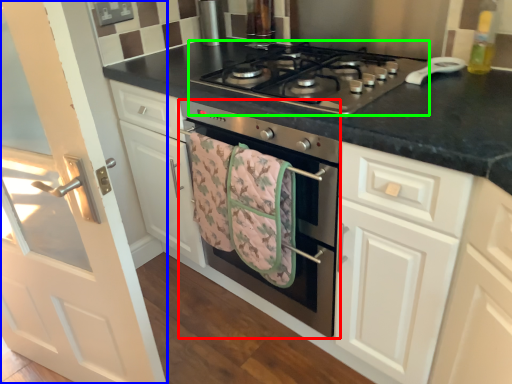
Question: Based on their relative distances, which object is nearer to oven (highlighted by a red box)? Choose from door (highlighted by a blue box) and gas stove (highlighted by a green box).

Choices:
 (A) door
 (B) gas stove

Answer: (B)